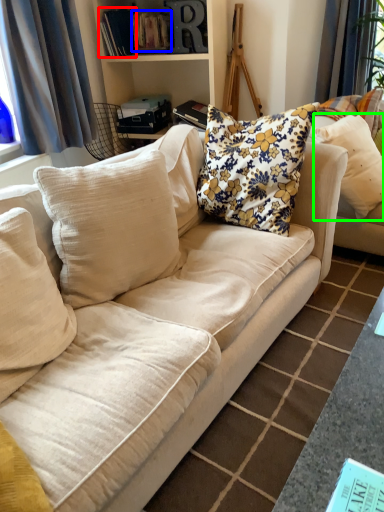
Question: Which object is the farthest from book (highlighted by a red box)? Choose among these: book (highlighted by a blue box) or pillow (highlighted by a green box).

Choices:
 (A) book
 (B) pillow

Answer: (B)